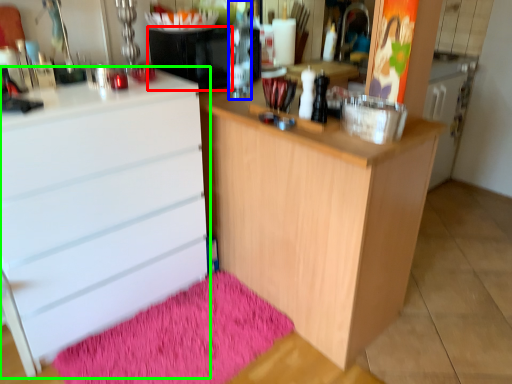
Question: Considering the real-world distances, which object is closest to appliance (highlighted by a red box)? bottle (highlighted by a blue box) or chest of drawers (highlighted by a green box).

Choices:
 (A) bottle
 (B) chest of drawers

Answer: (A)